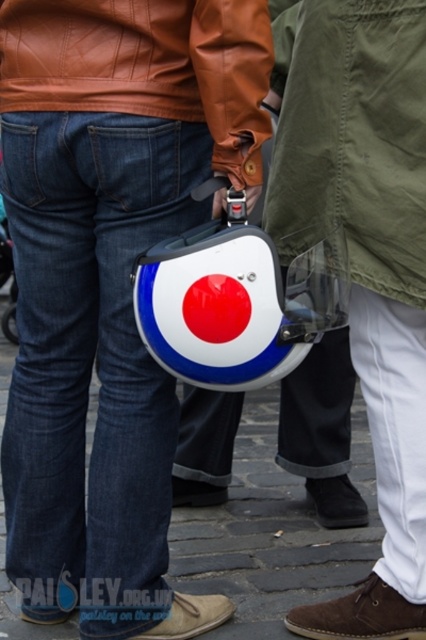
Question: Which point is closer to the camera?

Choices:
 (A) brown leather jacket at upper center
 (B) shiny plastic helmet at center

Answer: (A)

Question: From the image, what is the correct spatial relationship of matte black helmet at lower center in relation to brown leather jacket at upper center?

Choices:
 (A) right
 (B) left

Answer: (B)

Question: Estimate the real-world distances between objects in this image. Which object is farther from the shiny plastic helmet at center?

Choices:
 (A) olive green canvas jacket at center
 (B) brown leather jacket at upper center
 (C) matte black helmet at lower center

Answer: (A)

Question: Which object is positioned farthest from the matte black helmet at lower center?

Choices:
 (A) shiny plastic helmet at center
 (B) white glossy helmet at center
 (C) brown leather jacket at upper center
 (D) olive green canvas jacket at center

Answer: (B)

Question: Can you confirm if matte black helmet at lower center is positioned below olive green canvas jacket at center?

Choices:
 (A) yes
 (B) no

Answer: (A)

Question: Can you confirm if matte black helmet at lower center is positioned below brown leather jacket at upper center?

Choices:
 (A) yes
 (B) no

Answer: (A)